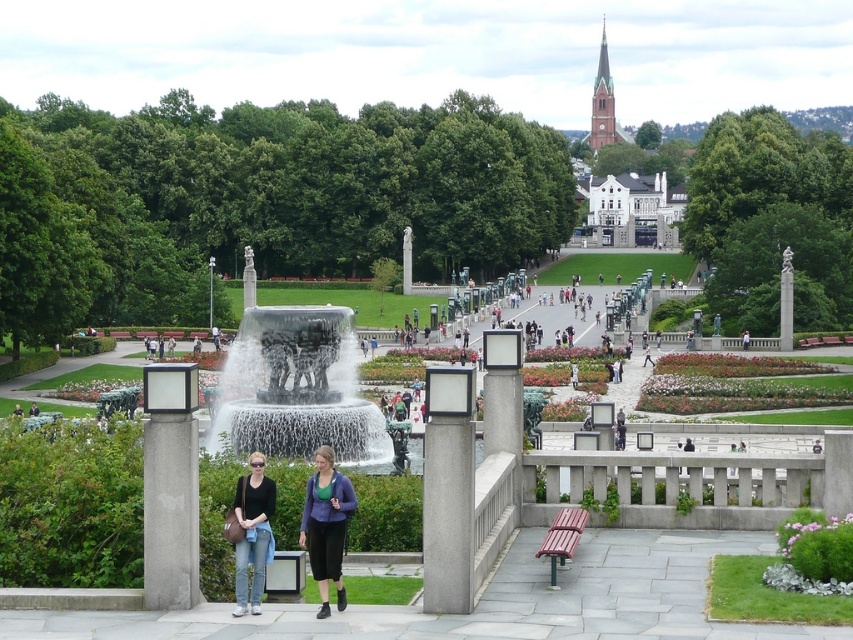
You are a photographer standing at the edge of the park and want to take a photo of both the smooth concrete fountain at center and the matte black jacket at center. If your camera has a maximum focus range of 8 meters, will you be able to capture both subjects clearly in the same frame?

The smooth concrete fountain at center is 8.38 meters away from the matte black jacket at center. Since the distance between them exceeds the camera lens focus range of 8 meters, capturing both clearly in the same frame may be challenging. The photographer might need to adjust their position or use a different lens to ensure both subjects are in focus.

You are a photographer positioned at the lower edge of the image, aiming to capture both the translucent glass water at center and the wooden bench at lower center in a single shot. Which object will appear closer to the camera in your photograph?

The translucent glass water at center will appear closer to the camera because it is further to the viewer than the wooden bench at lower center, meaning it occupies a more foreground position in the scene.